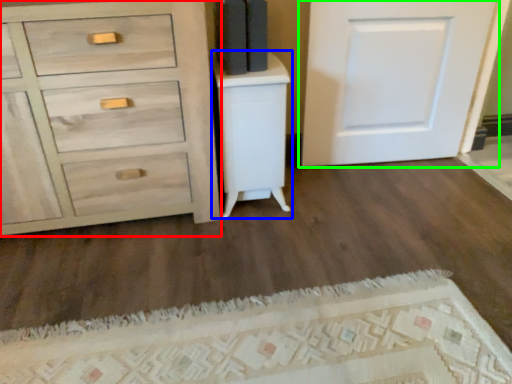
Question: Which is nearer to the chest of drawers (highlighted by a red box)? vanity (highlighted by a blue box) or door (highlighted by a green box).

Choices:
 (A) vanity
 (B) door

Answer: (A)